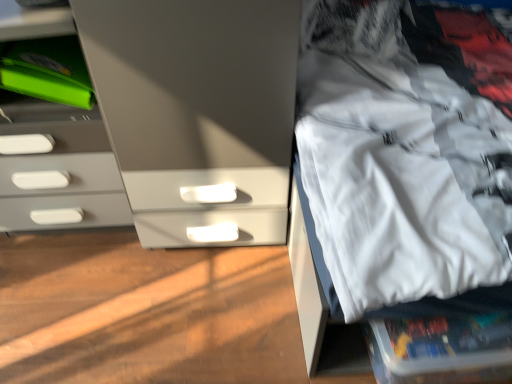
Question: Is matte gray chest of drawers at left taller or shorter than white fabric at right?

Choices:
 (A) short
 (B) tall

Answer: (A)

Question: In terms of width, does matte gray chest of drawers at left look wider or thinner when compared to white fabric at right?

Choices:
 (A) wide
 (B) thin

Answer: (B)

Question: Relative to white fabric at right, is matte gray chest of drawers at left in front or behind?

Choices:
 (A) front
 (B) behind

Answer: (B)

Question: Considering the positions of white fabric at right and matte gray chest of drawers at left in the image, is white fabric at right taller or shorter than matte gray chest of drawers at left?

Choices:
 (A) tall
 (B) short

Answer: (A)

Question: Does point (459, 61) appear closer or farther from the camera than point (11, 142)?

Choices:
 (A) closer
 (B) farther

Answer: (B)

Question: Is white fabric at right spatially inside matte gray chest of drawers at left, or outside of it?

Choices:
 (A) inside
 (B) outside

Answer: (B)

Question: Considering the positions of white fabric at right and matte gray chest of drawers at left in the image, is white fabric at right bigger or smaller than matte gray chest of drawers at left?

Choices:
 (A) big
 (B) small

Answer: (A)